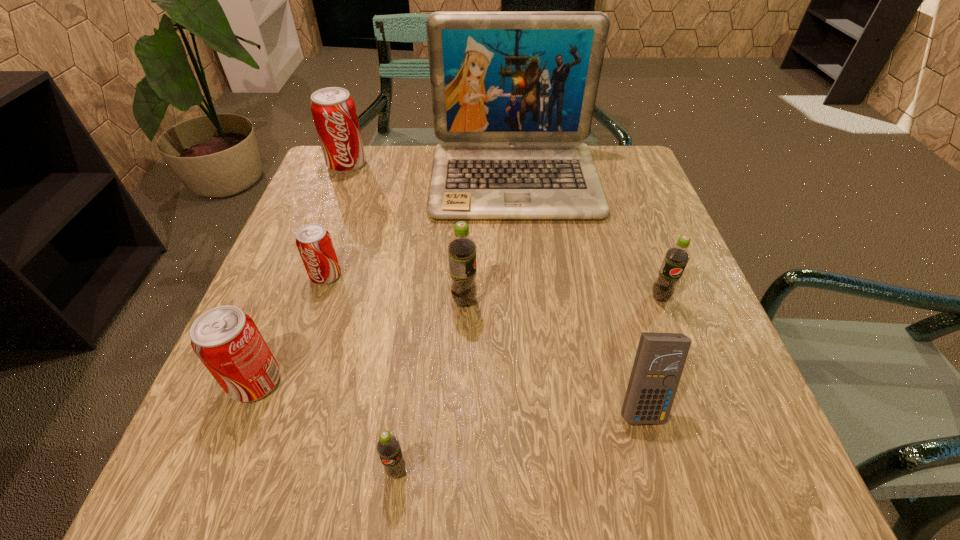
Locate which green soda ranks third in proximity to the blue calculator. Please provide its 2D coordinates. Your answer should be formatted as a tuple, i.e. [(x, y)], where the tuple contains the x and y coordinates of a point satisfying the conditions above.

[(388, 448)]